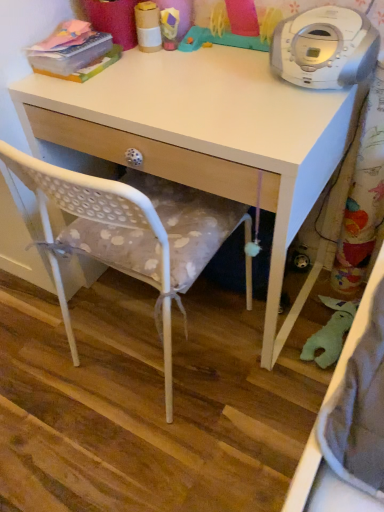
Where is `cardboard tube at upper center, which is the 1th toy from left to right`? cardboard tube at upper center, which is the 1th toy from left to right is located at coordinates (148, 26).

What do you see at coordinates (148, 26) in the screenshot? This screenshot has height=512, width=384. I see `cardboard tube at upper center, which is the 2th toy in right-to-left order` at bounding box center [148, 26].

What do you see at coordinates (324, 48) in the screenshot?
I see `white plastic cd player at upper right` at bounding box center [324, 48].

In order to face white plastic cd player at upper right, should I rotate leftwards or rightwards?

Rotate your view right by about 18.269°.

Image resolution: width=384 pixels, height=512 pixels. I want to click on rubber duck at upper center, which is the first toy from right to left, so click(x=234, y=27).

Describe the element at coordinates (202, 135) in the screenshot. I see `white matte desk at center` at that location.

What do you see at coordinates (134, 228) in the screenshot? I see `white polka dot fabric chair at center` at bounding box center [134, 228].

At what (x,y) coordinates should I click in order to perform the action: click on white polka dot fabric chair at center. Please return your answer as a coordinate pair (x, y). Looking at the image, I should click on (134, 228).

I want to click on cardboard tube at upper center, which is the 2th toy in right-to-left order, so click(x=148, y=26).

From the image's perspective, is white plastic cd player at upper right located beneath rubber duck at upper center, which ranks as the 2th toy in left-to-right order?

Correct, white plastic cd player at upper right appears lower than rubber duck at upper center, which ranks as the 2th toy in left-to-right order, in the image.

How different are the orientations of white plastic cd player at upper right and rubber duck at upper center, which ranks as the 2th toy in left-to-right order, in degrees?

The angular difference between white plastic cd player at upper right and rubber duck at upper center, which ranks as the 2th toy in left-to-right order, is 2.01 degrees.

Which point is more forward, (351, 21) or (226, 17)?

Point (351, 21)

Is white plastic cd player at upper right positioned before rubber duck at upper center, which ranks as the 2th toy in left-to-right order?

Yes, white plastic cd player at upper right is closer to the viewer.

From a real-world perspective, between white plastic cd player at upper right and cardboard tube at upper center, which is the 2th toy in right-to-left order, who is vertically lower?

cardboard tube at upper center, which is the 2th toy in right-to-left order, is physically lower.

Is point (307, 70) closer or farther from the camera than point (140, 6)?

Point (307, 70) appears to be closer to the viewer than point (140, 6).

Looking at this image, are white plastic cd player at upper right and cardboard tube at upper center, which is the 2th toy in right-to-left order, beside each other?

white plastic cd player at upper right is not next to cardboard tube at upper center, which is the 2th toy in right-to-left order, and they're not touching.

How many degrees apart are the facing directions of white polka dot fabric chair at center and cardboard tube at upper center, which is the 2th toy in right-to-left order?

The facing directions of white polka dot fabric chair at center and cardboard tube at upper center, which is the 2th toy in right-to-left order, are 180 degrees apart.

From a real-world perspective, between white polka dot fabric chair at center and cardboard tube at upper center, which is the 2th toy in right-to-left order, who is vertically higher?

cardboard tube at upper center, which is the 2th toy in right-to-left order, is physically above.

You are a GUI agent. You are given a task and a screenshot of the screen. Output one action in this format:
    pyautogui.click(x=<x>, y=<y>)
    Task: Click on the chair located on the right of cardboard tube at upper center, which is the 2th toy in right-to-left order
    This screenshot has width=384, height=512.
    Given the screenshot: What is the action you would take?
    pyautogui.click(x=134, y=228)

Is white matte desk at center turned away from white plastic cd player at upper right?

No.

Are white matte desk at center and white plastic cd player at upper right far apart?

They are positioned close to each other.

Locate an element on the screen. The image size is (384, 512). home appliance above the white matte desk at center (from a real-world perspective) is located at coordinates (324, 48).

Which object is further away from the camera, white matte desk at center or white plastic cd player at upper right?

white plastic cd player at upper right.

From the picture: Is cardboard tube at upper center, which is the 2th toy in right-to-left order, positioned far away from rubber duck at upper center, which ranks as the 2th toy in left-to-right order?

That's not correct — cardboard tube at upper center, which is the 2th toy in right-to-left order, is a little close to rubber duck at upper center, which ranks as the 2th toy in left-to-right order.

From the image's perspective, who appears lower, cardboard tube at upper center, which is the 1th toy from left to right, or rubber duck at upper center, which is the first toy from right to left?

rubber duck at upper center, which is the first toy from right to left.

Is cardboard tube at upper center, which is the 1th toy from left to right, to the left of rubber duck at upper center, which is the first toy from right to left, from the viewer's perspective?

Indeed, cardboard tube at upper center, which is the 1th toy from left to right, is positioned on the left side of rubber duck at upper center, which is the first toy from right to left.

Considering the sizes of objects cardboard tube at upper center, which is the 1th toy from left to right, and rubber duck at upper center, which ranks as the 2th toy in left-to-right order, in the image provided, who is thinner, cardboard tube at upper center, which is the 1th toy from left to right, or rubber duck at upper center, which ranks as the 2th toy in left-to-right order,?

Thinner between the two is cardboard tube at upper center, which is the 1th toy from left to right.

Does cardboard tube at upper center, which is the 2th toy in right-to-left order, lie in front of white plastic cd player at upper right?

No, cardboard tube at upper center, which is the 2th toy in right-to-left order, is further to the viewer.

Based on the photo, which object is wider, cardboard tube at upper center, which is the 2th toy in right-to-left order, or white plastic cd player at upper right?

white plastic cd player at upper right.

Do you think cardboard tube at upper center, which is the 2th toy in right-to-left order, is within white plastic cd player at upper right, or outside of it?

The correct answer is: outside.

From the picture: Is cardboard tube at upper center, which is the 1th toy from left to right, facing away from white plastic cd player at upper right?

cardboard tube at upper center, which is the 1th toy from left to right, is not turned away from white plastic cd player at upper right.

From the image's perspective, is white matte desk at center located above rubber duck at upper center, which is the first toy from right to left?

No, from the image's perspective, white matte desk at center is not above rubber duck at upper center, which is the first toy from right to left.

From a real-world perspective, is white matte desk at center under rubber duck at upper center, which ranks as the 2th toy in left-to-right order?

Yes.

Between white matte desk at center and rubber duck at upper center, which ranks as the 2th toy in left-to-right order, which one is positioned behind?

rubber duck at upper center, which ranks as the 2th toy in left-to-right order.

Is point (133, 109) positioned after point (240, 41)?

That is False.

I want to click on home appliance located in front of the rubber duck at upper center, which is the first toy from right to left, so click(324, 48).

This screenshot has height=512, width=384. I want to click on home appliance that is on the right side of cardboard tube at upper center, which is the 2th toy in right-to-left order, so click(324, 48).

When comparing their distances from white plastic cd player at upper right, does white matte desk at center or rubber duck at upper center, which ranks as the 2th toy in left-to-right order, seem further?

white matte desk at center is further to white plastic cd player at upper right.

Looking at the image, which one is located closer to rubber duck at upper center, which is the first toy from right to left, white polka dot fabric chair at center or cardboard tube at upper center, which is the 1th toy from left to right?

The object closer to rubber duck at upper center, which is the first toy from right to left, is cardboard tube at upper center, which is the 1th toy from left to right.

Which object lies nearer to the anchor point white polka dot fabric chair at center, white matte desk at center or cardboard tube at upper center, which is the 2th toy in right-to-left order?

The object closer to white polka dot fabric chair at center is white matte desk at center.

From the picture: When comparing their distances from cardboard tube at upper center, which is the 2th toy in right-to-left order, does white plastic cd player at upper right or white matte desk at center seem further?

white plastic cd player at upper right is positioned further to the anchor cardboard tube at upper center, which is the 2th toy in right-to-left order.

Which object lies nearer to the anchor point white matte desk at center, white polka dot fabric chair at center or rubber duck at upper center, which ranks as the 2th toy in left-to-right order?

The object closer to white matte desk at center is white polka dot fabric chair at center.

Based on their spatial positions, is white polka dot fabric chair at center or white matte desk at center further from rubber duck at upper center, which is the first toy from right to left?

white polka dot fabric chair at center.

Which object lies further to the anchor point cardboard tube at upper center, which is the 1th toy from left to right, white plastic cd player at upper right or rubber duck at upper center, which ranks as the 2th toy in left-to-right order?

white plastic cd player at upper right lies further to cardboard tube at upper center, which is the 1th toy from left to right, than the other object.

In the scene shown: Looking at the image, which one is located further to white plastic cd player at upper right, cardboard tube at upper center, which is the 2th toy in right-to-left order, or white polka dot fabric chair at center?

Among the two, white polka dot fabric chair at center is located further to white plastic cd player at upper right.

Locate an element on the screen. home appliance between rubber duck at upper center, which ranks as the 2th toy in left-to-right order, and white matte desk at center in the up-down direction is located at coordinates (324, 48).

You are a GUI agent. You are given a task and a screenshot of the screen. Output one action in this format:
    pyautogui.click(x=<x>, y=<y>)
    Task: Click on the toy between cardboard tube at upper center, which is the 2th toy in right-to-left order, and white matte desk at center vertically
    This screenshot has width=384, height=512.
    Given the screenshot: What is the action you would take?
    pyautogui.click(x=234, y=27)

I want to click on home appliance between cardboard tube at upper center, which is the 2th toy in right-to-left order, and white matte desk at center vertically, so click(324, 48).

You are a GUI agent. You are given a task and a screenshot of the screen. Output one action in this format:
    pyautogui.click(x=<x>, y=<y>)
    Task: Click on the home appliance between cardboard tube at upper center, which is the 2th toy in right-to-left order, and white polka dot fabric chair at center, in the vertical direction
    
    Given the screenshot: What is the action you would take?
    324,48